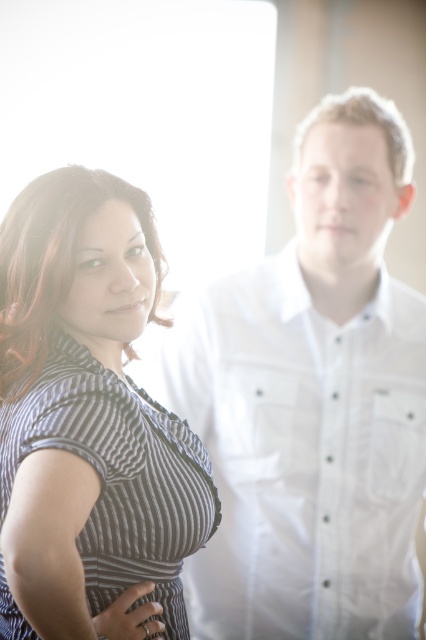
Is white cotton shirt at left taller than striped fabric dress at left?

Indeed, white cotton shirt at left has a greater height compared to striped fabric dress at left.

Does white cotton shirt at left come in front of striped fabric dress at left?

That is False.

Is point (402, 408) behind point (48, 193)?

Yes, it is.

At what (x,y) coordinates should I click in order to perform the action: click on white cotton shirt at left. Please return your answer as a coordinate pair (x, y). The image size is (426, 640). Looking at the image, I should click on (302, 456).